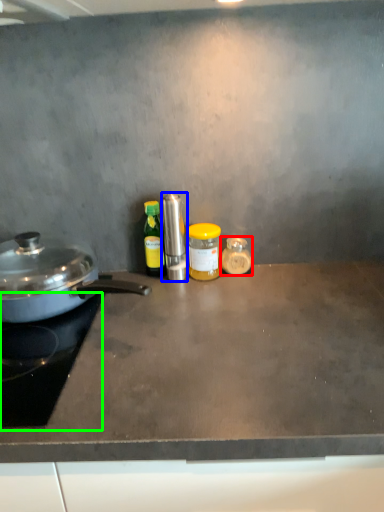
Question: Based on their relative distances, which object is nearer to kitchen appliance (highlighted by a red box)? Choose from kitchen appliance (highlighted by a blue box) and gas stove (highlighted by a green box).

Choices:
 (A) kitchen appliance
 (B) gas stove

Answer: (A)